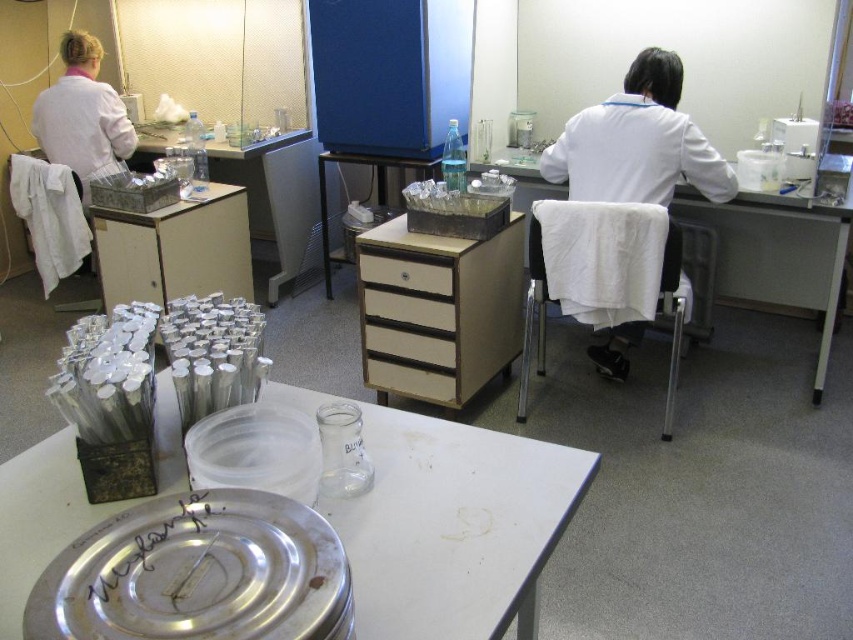
Can you confirm if metallic silver plate at center is positioned above beige matte drawer at center?

No, metallic silver plate at center is not above beige matte drawer at center.

Is metallic silver plate at center closer to camera compared to beige matte drawer at center?

Yes, it is in front of beige matte drawer at center.

Is point (465, 529) positioned behind point (432, 400)?

No, it is not.

Where is `metallic silver plate at center`? The image size is (853, 640). metallic silver plate at center is located at coordinates (454, 525).

How far apart are beige matte drawer at center and wooden drawer at center?

beige matte drawer at center is 3.55 feet away from wooden drawer at center.

Between point (445, 365) and point (318, 195), which one is positioned in front?

Point (445, 365) is in front.

Between point (422, 346) and point (421, 164), which one is positioned behind?

The point (421, 164) is more distant.

The image size is (853, 640). Identify the location of beige matte drawer at center. (408, 326).

Which is more to the left, white matte lab coat at center or white lab coat at left?

From the viewer's perspective, white lab coat at left appears more on the left side.

Can you confirm if white matte lab coat at center is thinner than white lab coat at left?

No, white matte lab coat at center is not thinner than white lab coat at left.

The image size is (853, 640). Identify the location of white matte lab coat at center. (637, 141).